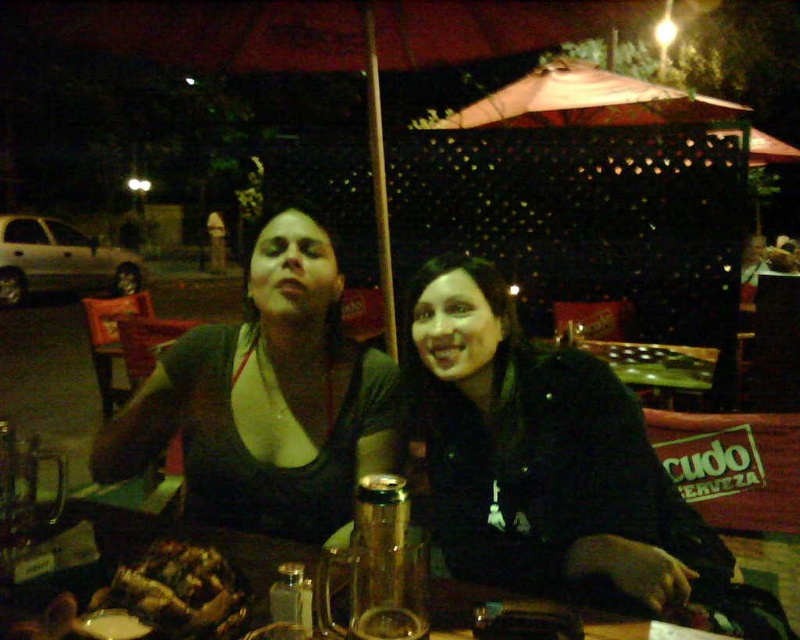
Question: Where is brown crispy chicken at lower left located in relation to translucent glass table at center in the image?

Choices:
 (A) below
 (B) above

Answer: (B)

Question: Based on their relative distances, which object is nearer to the brown crispy chicken at lower left?

Choices:
 (A) black matte jacket at center
 (B) matte black top at center

Answer: (B)

Question: Does matte black top at center have a greater width compared to translucent glass table at center?

Choices:
 (A) no
 (B) yes

Answer: (A)

Question: Where is black matte jacket at center located in relation to matte black top at center in the image?

Choices:
 (A) right
 (B) left

Answer: (A)

Question: Which object appears closest to the camera in this image?

Choices:
 (A) matte black top at center
 (B) black matte jacket at center
 (C) brown crispy chicken at lower left

Answer: (C)

Question: Among these objects, which one is nearest to the camera?

Choices:
 (A) matte black top at center
 (B) black matte jacket at center

Answer: (B)